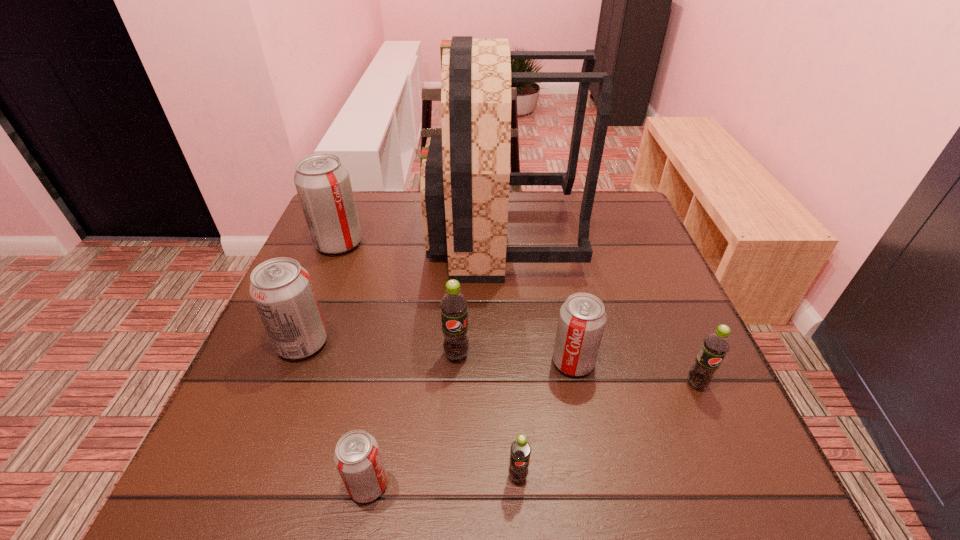
Where is `vacant space in between the nearest gray soda can and the tallest object`? vacant space in between the nearest gray soda can and the tallest object is located at coordinates (435, 360).

Where is `object that ranks as the second closest to the rightmost soda can`? object that ranks as the second closest to the rightmost soda can is located at coordinates (465, 173).

Identify which object is the fifth closest to the farthest gray soda can. Please provide its 2D coordinates. Your answer should be formatted as a tuple, i.e. [(x, y)], where the tuple contains the x and y coordinates of a point satisfying the conditions above.

[(357, 457)]

Locate which soda can is the seventh closest to the tallest object. Please provide its 2D coordinates. Your answer should be formatted as a tuple, i.e. [(x, y)], where the tuple contains the x and y coordinates of a point satisfying the conditions above.

[(520, 450)]

You are a GUI agent. You are given a task and a screenshot of the screen. Output one action in this format:
    pyautogui.click(x=<x>, y=<y>)
    Task: Click on the soda can that stands as the fifth closest to the fifth soda can from left to right
    
    Given the screenshot: What is the action you would take?
    pyautogui.click(x=282, y=291)

Select which gray soda can appears as the closest to the smallest gray soda can. Please provide its 2D coordinates. Your answer should be formatted as a tuple, i.e. [(x, y)], where the tuple contains the x and y coordinates of a point satisfying the conditions above.

[(282, 291)]

Identify the location of gray soda can object that ranks as the third closest to the second soda can from right to left. The width and height of the screenshot is (960, 540). (322, 182).

Find the location of a particular element. The image size is (960, 540). green soda that is the closest to the second smallest green soda is located at coordinates [x=520, y=450].

Identify which green soda is located as the nearest to the farthest gray soda can. Please provide its 2D coordinates. Your answer should be formatted as a tuple, i.e. [(x, y)], where the tuple contains the x and y coordinates of a point satisfying the conditions above.

[(454, 306)]

At what (x,y) coordinates should I click in order to perform the action: click on vacant space that satisfies the following two spatial constraints: 1. on the front face of the backpack; 2. on the front side of the smallest gray soda can. Please return your answer as a coordinate pair (x, y). This screenshot has height=540, width=960. Looking at the image, I should click on (517, 484).